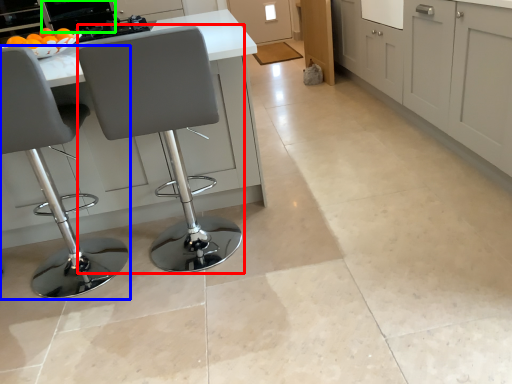
Question: Which object is the closest to the chair (highlighted by a red box)? Choose among these: chair (highlighted by a blue box) or appliance (highlighted by a green box).

Choices:
 (A) chair
 (B) appliance

Answer: (A)